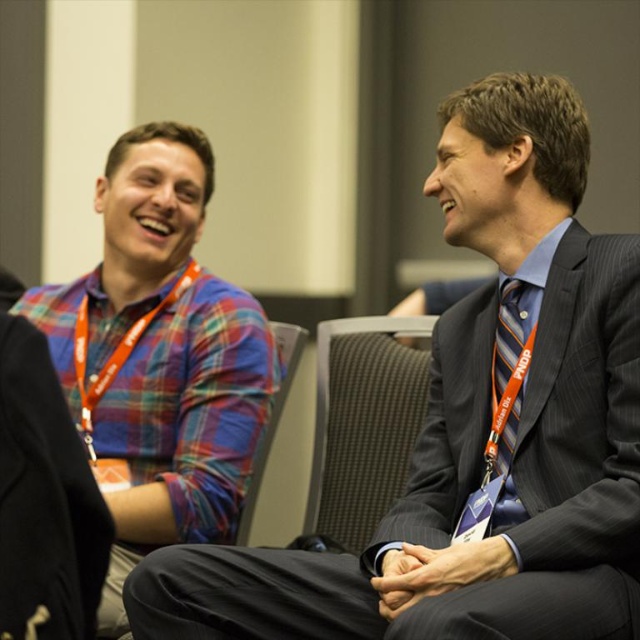
You are standing in the conference room and want to take a photo of both point (579, 433) and point (177, 406). Which point should you focus on first to ensure both are in clear view?

Point (579, 433) is closer to the camera than point (177, 406), so you should focus on point (579, 433) first to ensure both are in clear view.

You are designing a new uniform for conference attendees. The plaid fabric shirt at upper left and the gray fabric chair at center are part of the design inspiration. Which item has a greater width?

The plaid fabric shirt at upper left has a greater width than the gray fabric chair at center according to the description.

You are an interior designer assessing the layout of this conference room. The plaid fabric shirt at upper left and the gray fabric chair at center are two elements you need to consider. Based on their sizes, which object would you say is taller?

The plaid fabric shirt at upper left is taller than the gray fabric chair at center.